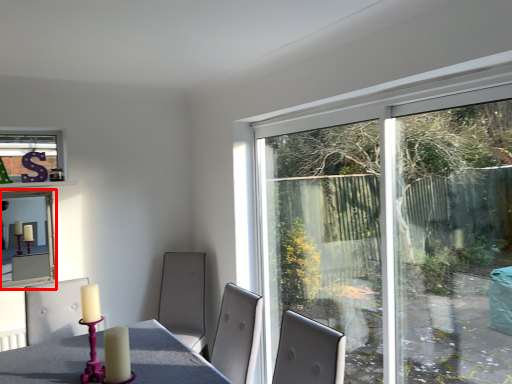
Question: Where is window screen (annotated by the red box) located in relation to window in the image?

Choices:
 (A) right
 (B) left

Answer: (B)